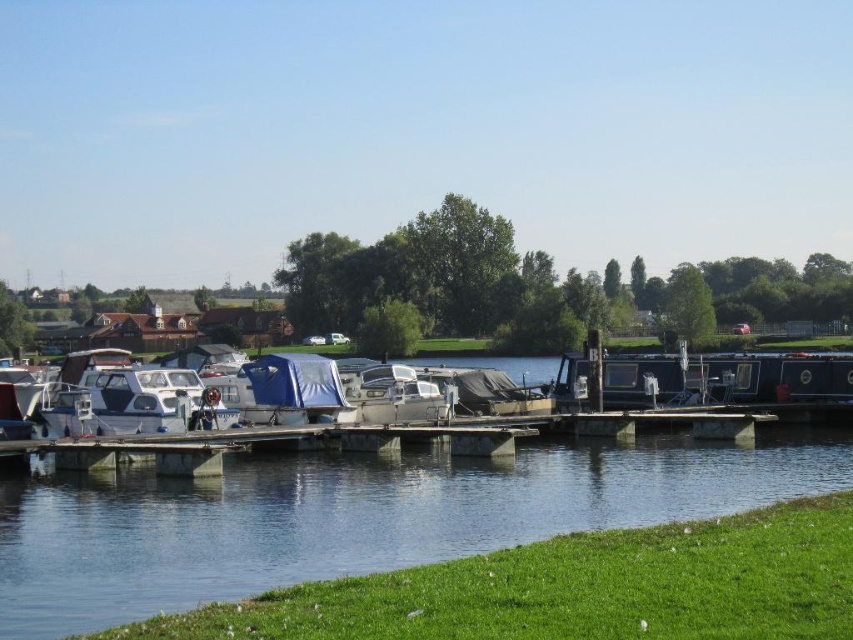
Question: Can you confirm if white glossy boat at center is smaller than metallic silver boat at center?

Choices:
 (A) yes
 (B) no

Answer: (B)

Question: Based on their relative distances, which object is farther from the white glossy boat at center?

Choices:
 (A) metallic silver boat at center
 (B) clear water at center

Answer: (A)

Question: Among these objects, which one is farthest from the camera?

Choices:
 (A) metallic silver boat at center
 (B) white glossy boat at center
 (C) clear water at center

Answer: (A)

Question: Which of the following is the closest to the observer?

Choices:
 (A) (117, 426)
 (B) (401, 408)
 (C) (209, 582)

Answer: (C)

Question: Can you confirm if clear water at center is positioned above white glossy boat at center?

Choices:
 (A) yes
 (B) no

Answer: (B)

Question: Is clear water at center in front of white glossy boat at center?

Choices:
 (A) no
 (B) yes

Answer: (B)